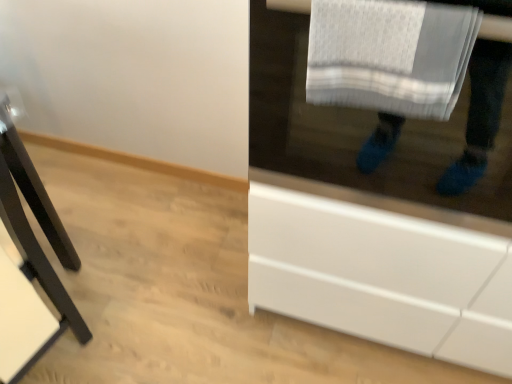
Question: Considering the relative sizes of white glossy cabinet at lower right and white textured towel at upper right in the image provided, is white glossy cabinet at lower right taller than white textured towel at upper right?

Choices:
 (A) no
 (B) yes

Answer: (B)

Question: Can you confirm if white glossy cabinet at lower right is positioned to the right of white textured towel at upper right?

Choices:
 (A) yes
 (B) no

Answer: (A)

Question: Is white glossy cabinet at lower right turned away from white textured towel at upper right?

Choices:
 (A) no
 (B) yes

Answer: (A)

Question: From the image's perspective, is white glossy cabinet at lower right on white textured towel at upper right?

Choices:
 (A) yes
 (B) no

Answer: (A)

Question: From a real-world perspective, is white glossy cabinet at lower right positioned over white textured towel at upper right based on gravity?

Choices:
 (A) no
 (B) yes

Answer: (A)

Question: From the image's perspective, is white glossy cabinet at lower right positioned above or below black matte table at left?

Choices:
 (A) below
 (B) above

Answer: (B)

Question: Considering the positions of white glossy cabinet at lower right and black matte table at left in the image, is white glossy cabinet at lower right wider or thinner than black matte table at left?

Choices:
 (A) wide
 (B) thin

Answer: (A)

Question: Is white glossy cabinet at lower right in front of or behind black matte table at left in the image?

Choices:
 (A) front
 (B) behind

Answer: (A)

Question: In terms of size, does white glossy cabinet at lower right appear bigger or smaller than black matte table at left?

Choices:
 (A) big
 (B) small

Answer: (A)

Question: From their relative heights in the image, would you say black matte table at left is taller or shorter than white textured towel at upper right?

Choices:
 (A) tall
 (B) short

Answer: (A)

Question: From the image's perspective, relative to white textured towel at upper right, is black matte table at left above or below?

Choices:
 (A) below
 (B) above

Answer: (A)

Question: Is black matte table at left wider or thinner than white textured towel at upper right?

Choices:
 (A) wide
 (B) thin

Answer: (A)

Question: Do you think black matte table at left is within white textured towel at upper right, or outside of it?

Choices:
 (A) outside
 (B) inside

Answer: (A)

Question: Looking at their shapes, would you say black matte table at left is wider or thinner than white glossy cabinet at lower right?

Choices:
 (A) wide
 (B) thin

Answer: (B)

Question: Is point (15, 228) positioned closer to the camera than point (430, 235)?

Choices:
 (A) farther
 (B) closer

Answer: (A)